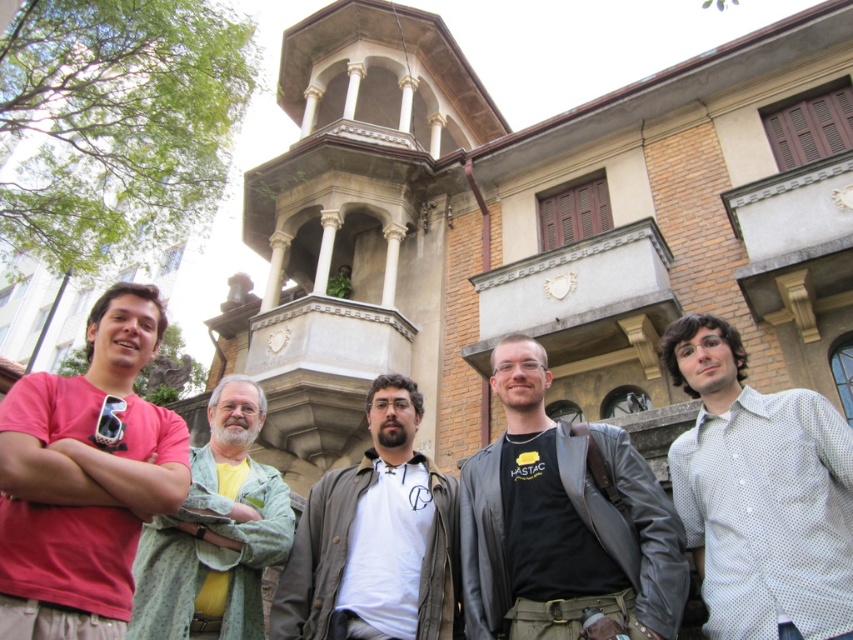
Question: Which of the following is the farthest from the observer?

Choices:
 (A) green textured shirt at left
 (B) black leather jacket at center

Answer: (A)

Question: Does matte pink shirt at center have a lesser width compared to black leather jacket at center?

Choices:
 (A) no
 (B) yes

Answer: (B)

Question: Estimate the real-world distances between objects in this image. Which object is farther from the green textured shirt at left?

Choices:
 (A) matte pink shirt at center
 (B) white matte shirt at center
 (C) black leather jacket at center

Answer: (C)

Question: In this image, where is white dotted shirt at right located relative to white matte shirt at center?

Choices:
 (A) above
 (B) below

Answer: (A)

Question: Which point is closer to the camera?

Choices:
 (A) (202, 600)
 (B) (480, 563)

Answer: (A)

Question: Can you confirm if matte pink shirt at center is wider than black leather jacket at center?

Choices:
 (A) yes
 (B) no

Answer: (B)